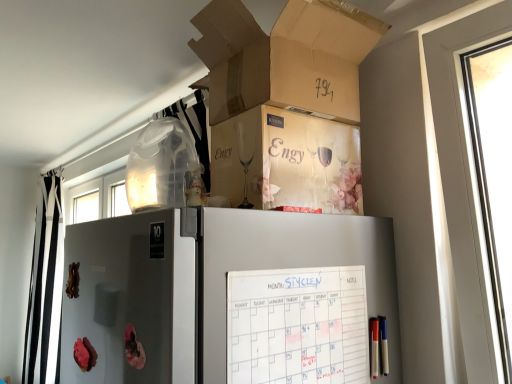
Question: Is black/white striped curtain at left positioned with its back to metallic silver screen door at lower left?

Choices:
 (A) no
 (B) yes

Answer: (A)

Question: Considering the relative sizes of black/white striped curtain at left and metallic silver screen door at lower left in the image provided, is black/white striped curtain at left wider than metallic silver screen door at lower left?

Choices:
 (A) yes
 (B) no

Answer: (A)

Question: Does black/white striped curtain at left appear on the right side of metallic silver screen door at lower left?

Choices:
 (A) no
 (B) yes

Answer: (A)

Question: Does black/white striped curtain at left have a larger size compared to metallic silver screen door at lower left?

Choices:
 (A) no
 (B) yes

Answer: (B)

Question: Can you confirm if black/white striped curtain at left is smaller than metallic silver screen door at lower left?

Choices:
 (A) no
 (B) yes

Answer: (A)

Question: Is black/white striped curtain at left bigger or smaller than metallic silver screen door at lower left?

Choices:
 (A) big
 (B) small

Answer: (A)

Question: In terms of height, does black/white striped curtain at left look taller or shorter compared to metallic silver screen door at lower left?

Choices:
 (A) short
 (B) tall

Answer: (B)

Question: Based on their positions, is black/white striped curtain at left located to the left or right of metallic silver screen door at lower left?

Choices:
 (A) left
 (B) right

Answer: (A)

Question: Considering the positions of point (44, 286) and point (77, 307), is point (44, 286) closer or farther from the camera than point (77, 307)?

Choices:
 (A) farther
 (B) closer

Answer: (A)

Question: In the image, is metallic silver screen door at lower left positioned in front of or behind cardboard box at upper center?

Choices:
 (A) front
 (B) behind

Answer: (A)

Question: Is metallic silver screen door at lower left inside or outside of cardboard box at upper center?

Choices:
 (A) inside
 (B) outside

Answer: (B)

Question: From their relative heights in the image, would you say metallic silver screen door at lower left is taller or shorter than cardboard box at upper center?

Choices:
 (A) tall
 (B) short

Answer: (A)

Question: From a real-world perspective, relative to cardboard box at upper center, is metallic silver screen door at lower left vertically above or below?

Choices:
 (A) above
 (B) below

Answer: (B)

Question: Considering the relative positions of metallic silver screen door at lower left and white paper calendar at upper center in the image provided, is metallic silver screen door at lower left to the left or to the right of white paper calendar at upper center?

Choices:
 (A) left
 (B) right

Answer: (A)

Question: Would you say metallic silver screen door at lower left is inside or outside white paper calendar at upper center?

Choices:
 (A) inside
 (B) outside

Answer: (B)